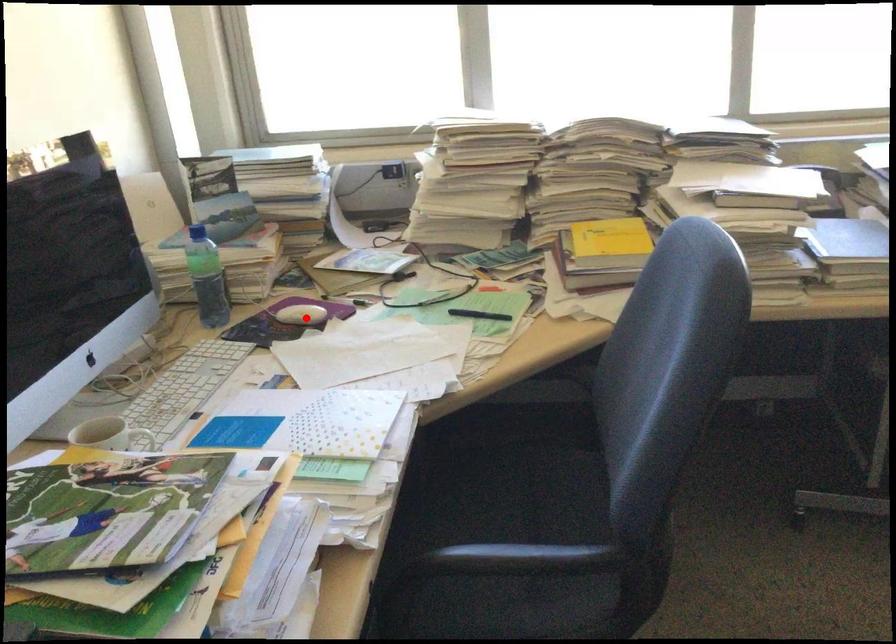
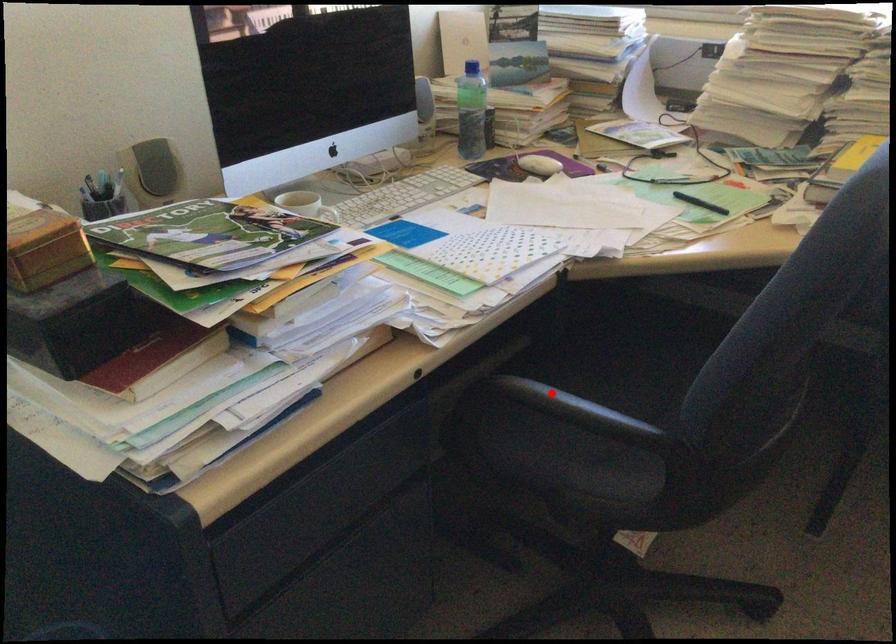
I am providing you with two images of the same scene from different viewpoints. A red point is marked on the first image and another point is marked on the second image. Is the red point in image1 aligned with the point shown in image2?

No